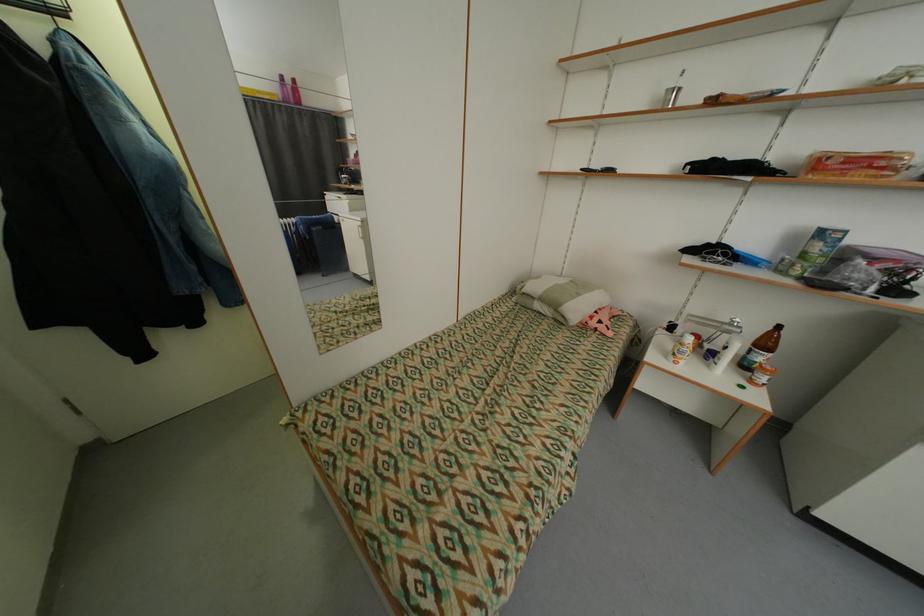
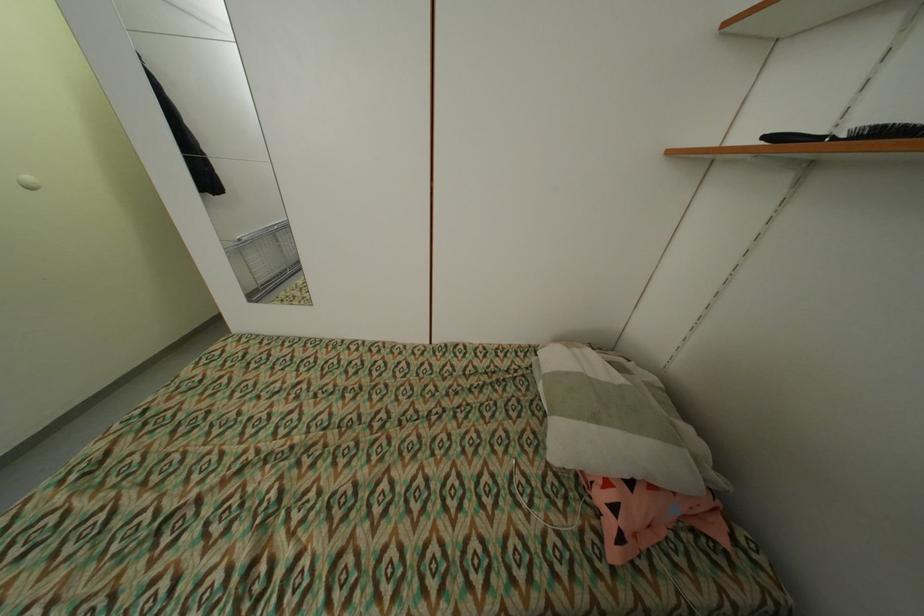
In the second image, find the point that corresponds to (x=600, y=323) in the first image.

(606, 498)